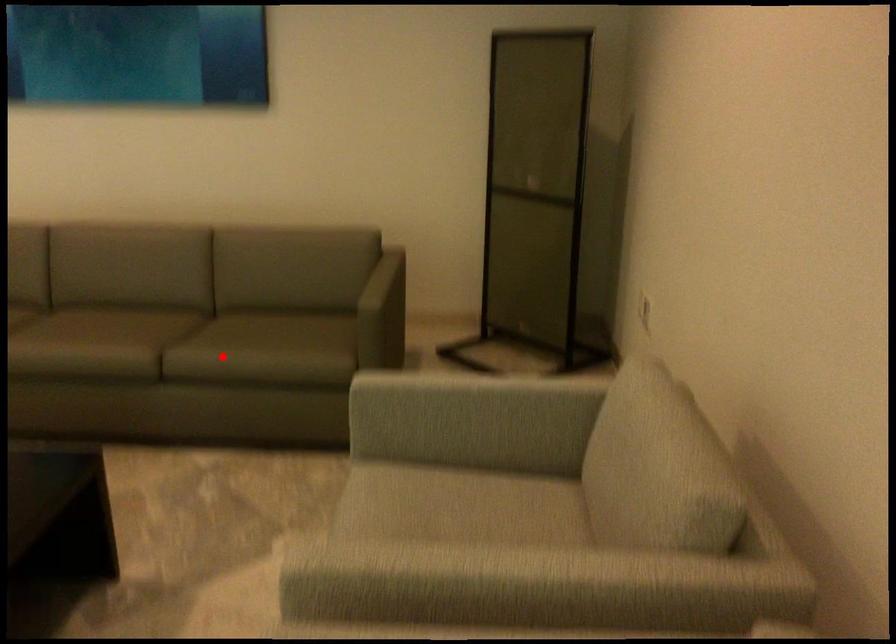
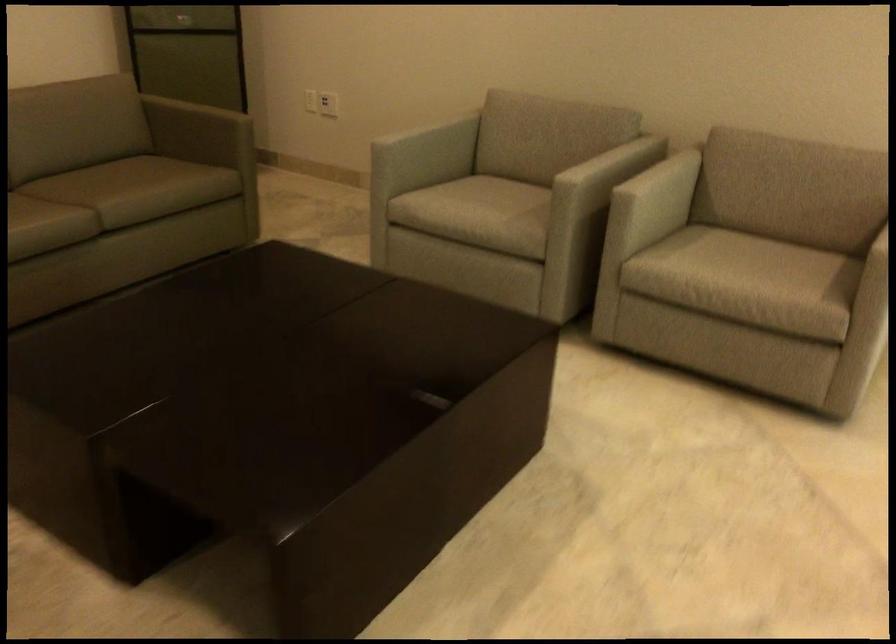
Find the pixel in the second image that matches the highlighted location in the first image.

(145, 187)